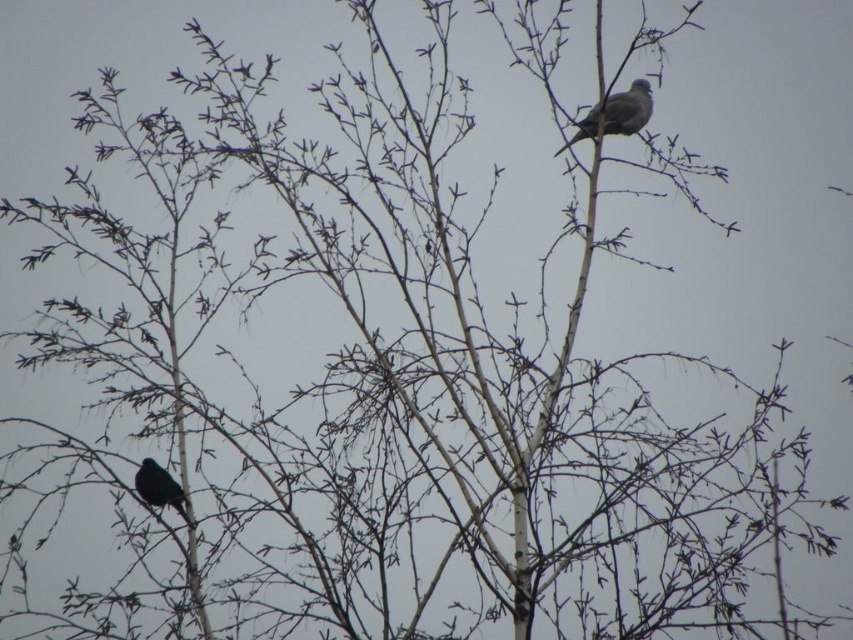
Is point (576, 136) positioned after point (148, 484)?

Yes, it is.

Is gray matte bird at upper center thinner than shiny black bird at lower left?

No, gray matte bird at upper center is not thinner than shiny black bird at lower left.

Is point (616, 106) positioned before point (161, 468)?

That is False.

This screenshot has width=853, height=640. Identify the location of gray matte bird at upper center. (616, 113).